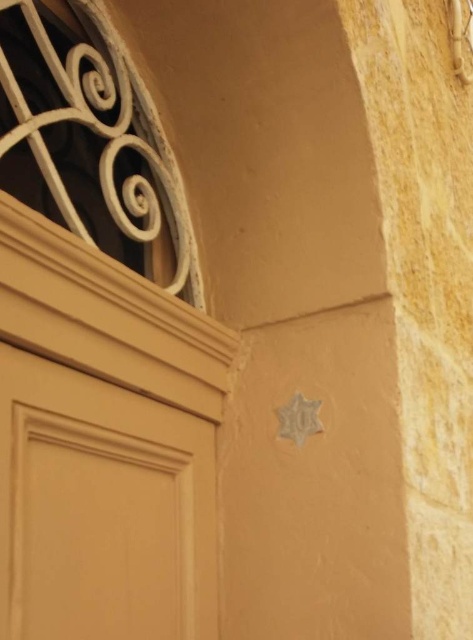
Question: Is matte wood door at lower left bigger than white matte spiral at upper left?

Choices:
 (A) yes
 (B) no

Answer: (B)

Question: Among these objects, which one is farthest from the camera?

Choices:
 (A) white matte spiral at upper left
 (B) matte wood door at lower left

Answer: (A)

Question: Does matte wood door at lower left appear under white matte spiral at upper left?

Choices:
 (A) yes
 (B) no

Answer: (A)

Question: Which point is farther to the camera?

Choices:
 (A) (204, 579)
 (B) (2, 141)

Answer: (A)

Question: Is matte wood door at lower left positioned in front of white matte spiral at upper left?

Choices:
 (A) no
 (B) yes

Answer: (B)